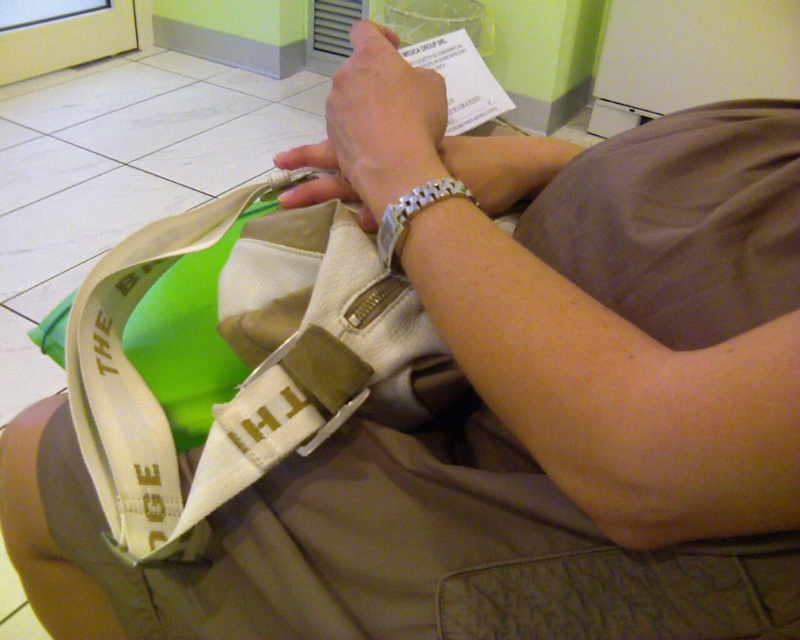
In the scene shown: You are a jeweler examining a customer who has a silver metallic watch at upper center and a silver metallic bracelet at upper center on their left wrist. The customer wants to know if both items can be worn together without overlapping. Can you determine if there is enough space between them?

The silver metallic watch at upper center and silver metallic bracelet at upper center are 2.96 inches apart, so there is sufficient space to wear both items together without overlapping.